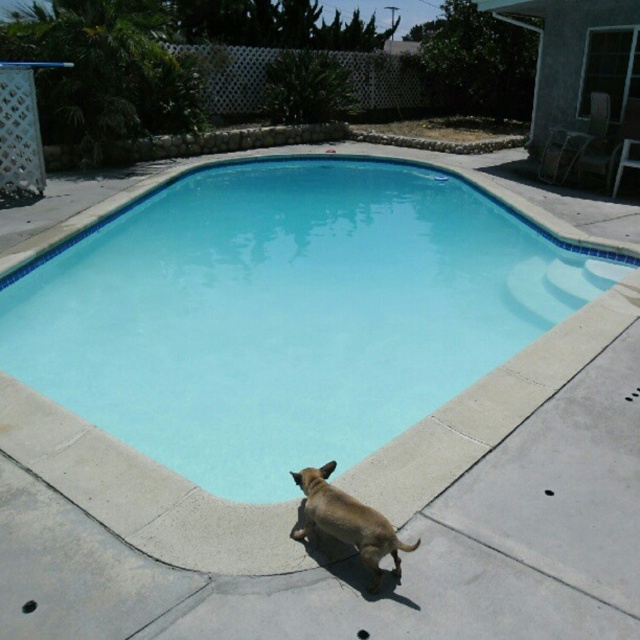
Is point (314, 289) positioned after point (349, 524)?

Yes, it is.

In the scene shown: Who is positioned more to the right, blue smooth pool at center or brown matte dog at lower center?

blue smooth pool at center is more to the right.

Is point (220, 321) farther from camera compared to point (326, 474)?

Yes, it is.

Where is `blue smooth pool at center`? This screenshot has width=640, height=640. blue smooth pool at center is located at coordinates (285, 312).